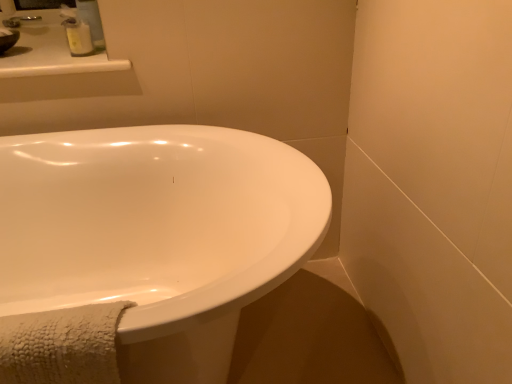
Question: Does white glossy bathtub at lower left have a greater height compared to white plastic soap dispenser at upper left?

Choices:
 (A) no
 (B) yes

Answer: (B)

Question: Can you confirm if white glossy bathtub at lower left is shorter than white plastic soap dispenser at upper left?

Choices:
 (A) yes
 (B) no

Answer: (B)

Question: Considering the relative sizes of white glossy bathtub at lower left and white plastic soap dispenser at upper left in the image provided, is white glossy bathtub at lower left bigger than white plastic soap dispenser at upper left?

Choices:
 (A) no
 (B) yes

Answer: (B)

Question: Would you say white plastic soap dispenser at upper left is part of white glossy bathtub at lower left's contents?

Choices:
 (A) no
 (B) yes

Answer: (A)

Question: Is the depth of white glossy bathtub at lower left greater than that of white plastic soap dispenser at upper left?

Choices:
 (A) yes
 (B) no

Answer: (B)

Question: Considering the relative sizes of white glossy bathtub at lower left and white plastic soap dispenser at upper left in the image provided, is white glossy bathtub at lower left smaller than white plastic soap dispenser at upper left?

Choices:
 (A) yes
 (B) no

Answer: (B)

Question: Can you confirm if white glossy bathtub at lower left is wider than matte white sink at upper left?

Choices:
 (A) yes
 (B) no

Answer: (A)

Question: From the image's perspective, is white glossy bathtub at lower left over matte white sink at upper left?

Choices:
 (A) no
 (B) yes

Answer: (A)

Question: Does white glossy bathtub at lower left appear on the left side of matte white sink at upper left?

Choices:
 (A) yes
 (B) no

Answer: (B)

Question: Can you confirm if white glossy bathtub at lower left is smaller than matte white sink at upper left?

Choices:
 (A) no
 (B) yes

Answer: (A)

Question: Considering the relative sizes of white glossy bathtub at lower left and matte white sink at upper left in the image provided, is white glossy bathtub at lower left shorter than matte white sink at upper left?

Choices:
 (A) yes
 (B) no

Answer: (B)

Question: Is white glossy bathtub at lower left facing away from matte white sink at upper left?

Choices:
 (A) yes
 (B) no

Answer: (B)

Question: Is matte white sink at upper left positioned before white glossy bathtub at lower left?

Choices:
 (A) no
 (B) yes

Answer: (A)